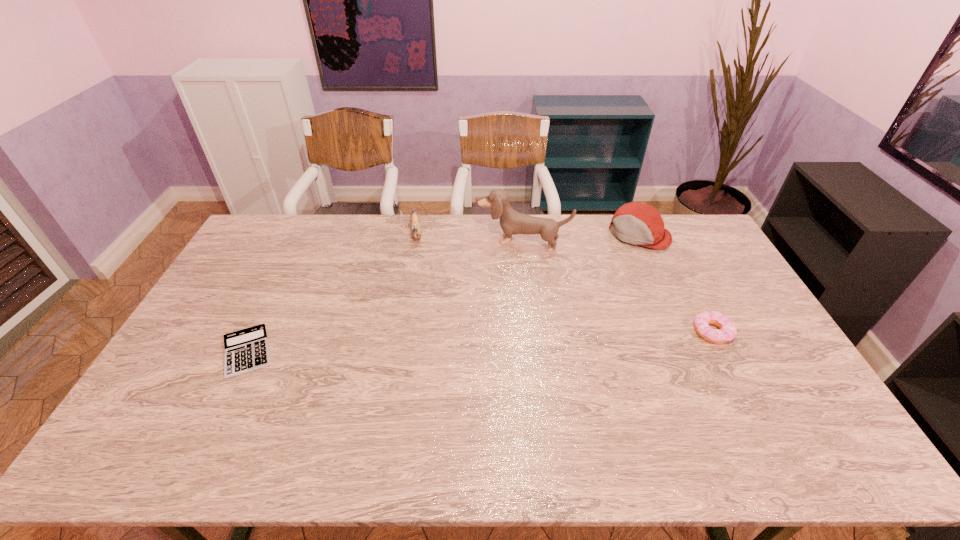
Find the location of a particular element. banana situated at the far edge is located at coordinates (414, 219).

You are a GUI agent. You are given a task and a screenshot of the screen. Output one action in this format:
    pyautogui.click(x=<x>, y=<y>)
    Task: Click on the object located in the left edge section of the desktop
    This screenshot has height=540, width=960.
    Given the screenshot: What is the action you would take?
    pyautogui.click(x=246, y=350)

I want to click on doughnut located at the right edge, so click(727, 331).

You are a GUI agent. You are given a task and a screenshot of the screen. Output one action in this format:
    pyautogui.click(x=<x>, y=<y>)
    Task: Click on the cap at the right edge
    The width and height of the screenshot is (960, 540).
    Given the screenshot: What is the action you would take?
    pyautogui.click(x=636, y=223)

Identify the location of object that is at the far right corner. The image size is (960, 540). (636, 223).

In the image, there is a desktop. At what (x,y) coordinates should I click in order to perform the action: click on vacant space at the far edge. Please return your answer as a coordinate pair (x, y). This screenshot has width=960, height=540. Looking at the image, I should click on (581, 218).

At what (x,y) coordinates should I click in order to perform the action: click on vacant position at the near edge of the desktop. Please return your answer as a coordinate pair (x, y). This screenshot has height=540, width=960. Looking at the image, I should click on pyautogui.click(x=259, y=421).

This screenshot has height=540, width=960. What are the coordinates of `blank space at the left edge of the desktop` in the screenshot? It's located at (220, 314).

In the image, there is a desktop. Where is `free space at the right edge`? The height and width of the screenshot is (540, 960). free space at the right edge is located at coordinates (686, 259).

This screenshot has width=960, height=540. I want to click on free region at the near right corner of the desktop, so click(785, 396).